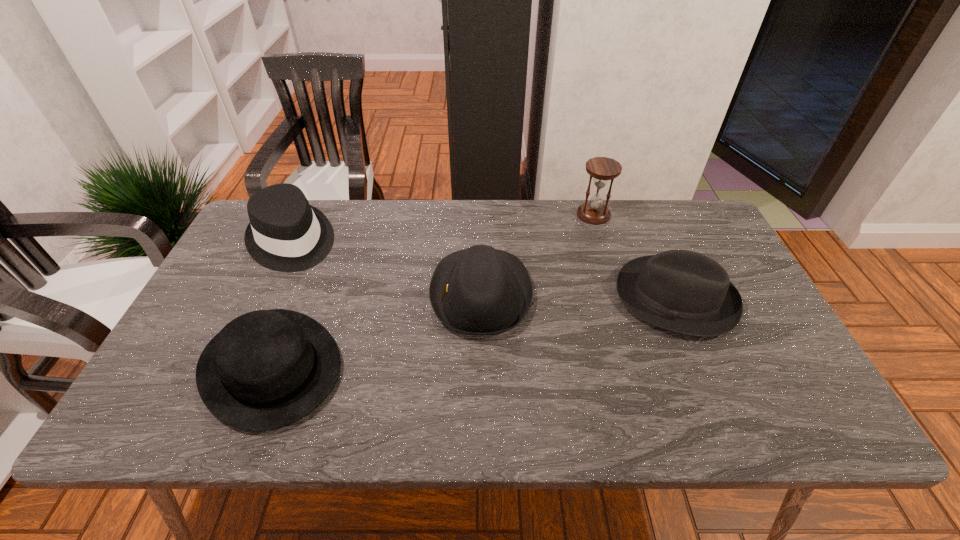
The image size is (960, 540). Find the location of `hourglass`. hourglass is located at coordinates (602, 169).

Image resolution: width=960 pixels, height=540 pixels. Find the location of `the third object from left to right`. the third object from left to right is located at coordinates (480, 290).

Image resolution: width=960 pixels, height=540 pixels. Find the location of `the rightmost fedora`. the rightmost fedora is located at coordinates (682, 291).

Find the location of `the shortest object`. the shortest object is located at coordinates (266, 369).

You are a GUI agent. You are given a task and a screenshot of the screen. Output one action in this format:
    pyautogui.click(x=<x>, y=<y>)
    Task: Click on the vacant area situated 0.130m on the left of the hourglass
    The image size is (960, 540).
    Given the screenshot: What is the action you would take?
    pyautogui.click(x=537, y=215)

Where is `vacant space situated on the front-facing side of the third object from left to right`? vacant space situated on the front-facing side of the third object from left to right is located at coordinates (374, 294).

In order to click on free space located 0.090m on the front-facing side of the third object from left to right in this screenshot , I will do `click(396, 294)`.

Find the location of `vacant space located on the front-facing side of the third object from left to right`. vacant space located on the front-facing side of the third object from left to right is located at coordinates (400, 294).

Locate an element on the screen. blank space located on the left of the rightmost fedora is located at coordinates (492, 298).

What are the coordinates of `vacant space located 0.220m on the back of the shortest fedora` in the screenshot? It's located at (315, 256).